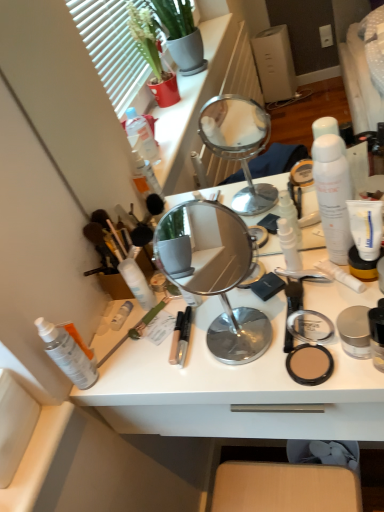
Find the location of a particular element. The height and width of the screenshot is (512, 384). unoccupied region to the right of white matte spray can at left, marked as the fifth toiletry in a right-to-left arrangement is located at coordinates (170, 347).